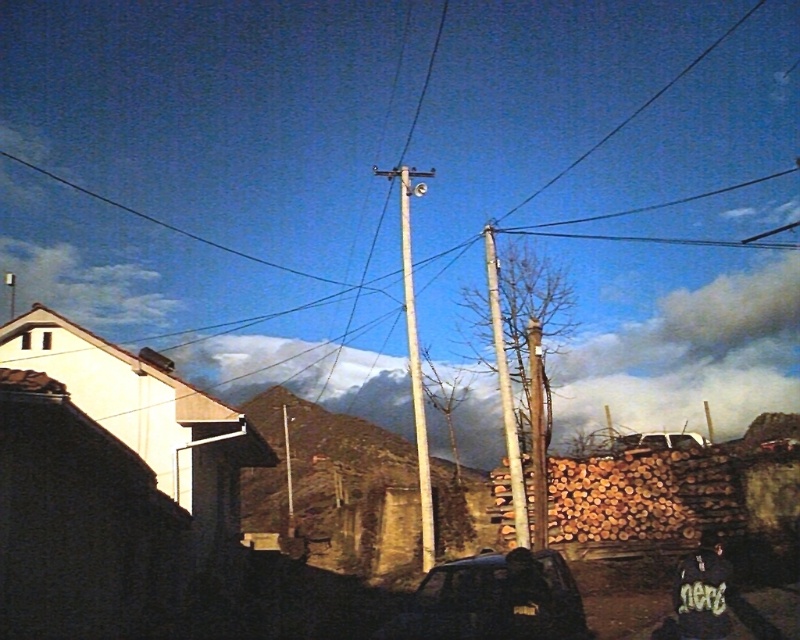
You are standing in the rural area looking at the smooth wooden telegraph pole at center and the smooth wood telegraph pole at center. Which one is closer to you?

The smooth wooden telegraph pole at center is closer to you than the smooth wood telegraph pole at center.

You are driving a car and see the smooth wood telegraph pole at center and the white matte car at center ahead. Which object is closer to the left side of your view?

The smooth wood telegraph pole at center is closer to the left side of your view because it is positioned to the left of the white matte car at center.